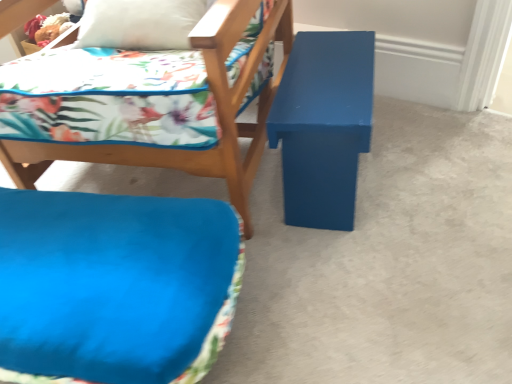
At what (x,y) coordinates should I click in order to perform the action: click on empty space that is ontop of matte blue bench at right. Please return your answer as a coordinate pair (x, y). The image size is (512, 384). Looking at the image, I should click on (329, 64).